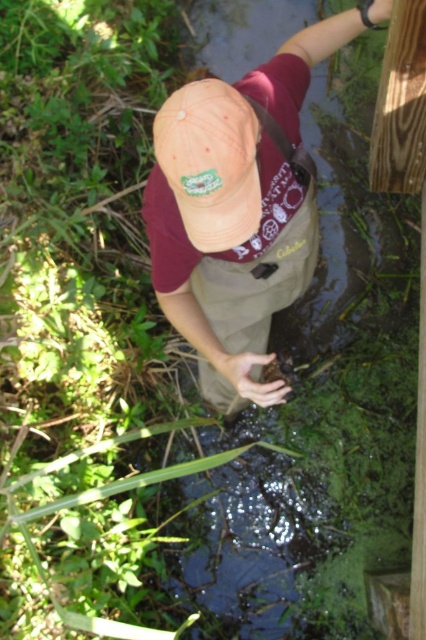
Question: Estimate the real-world distances between objects in this image. Which object is farther from the matte orange cap at center?

Choices:
 (A) tan canvas hat at upper center
 (B) khaki fabric at center

Answer: (B)

Question: Does matte orange cap at center appear on the right side of khaki fabric at center?

Choices:
 (A) yes
 (B) no

Answer: (B)

Question: Which of the following is the farthest from the observer?

Choices:
 (A) (195, 195)
 (B) (282, 307)
 (C) (252, 237)

Answer: (B)

Question: Which object appears farthest from the camera in this image?

Choices:
 (A) tan canvas hat at upper center
 (B) matte orange cap at center
 (C) khaki fabric at center

Answer: (C)

Question: Does tan canvas hat at upper center lie behind matte orange cap at center?

Choices:
 (A) yes
 (B) no

Answer: (A)

Question: Does tan canvas hat at upper center have a greater width compared to khaki fabric at center?

Choices:
 (A) no
 (B) yes

Answer: (B)